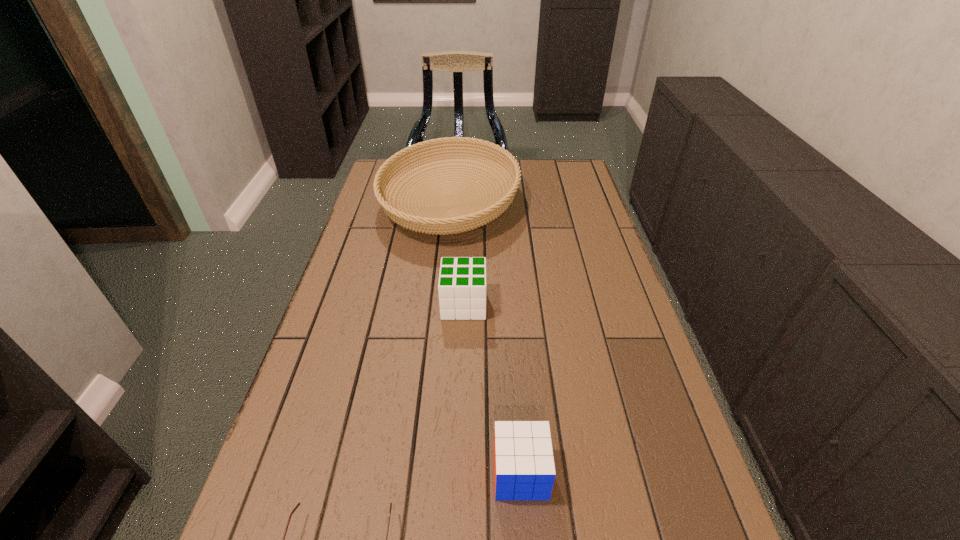
Where is `basket`? This screenshot has width=960, height=540. basket is located at coordinates coord(433,220).

Locate an element on the screen. This screenshot has height=540, width=960. the farther cube is located at coordinates (462, 280).

The height and width of the screenshot is (540, 960). I want to click on the third nearest object, so click(x=462, y=280).

Locate an element on the screen. The height and width of the screenshot is (540, 960). the third farthest object is located at coordinates (524, 469).

In order to click on the right cube in this screenshot , I will do `click(524, 469)`.

Locate an element on the screen. free region located on the front of the farthest object is located at coordinates (444, 270).

I want to click on free location located on the red face of the second farthest object, so click(573, 305).

This screenshot has height=540, width=960. I want to click on free space located on the left of the second shortest object, so click(323, 474).

Where is `object that is at the far edge`? Image resolution: width=960 pixels, height=540 pixels. object that is at the far edge is located at coordinates (433, 220).

At what (x,y) coordinates should I click in order to perform the action: click on object at the left edge. Please return your answer as a coordinate pair (x, y). Looking at the image, I should click on (433, 220).